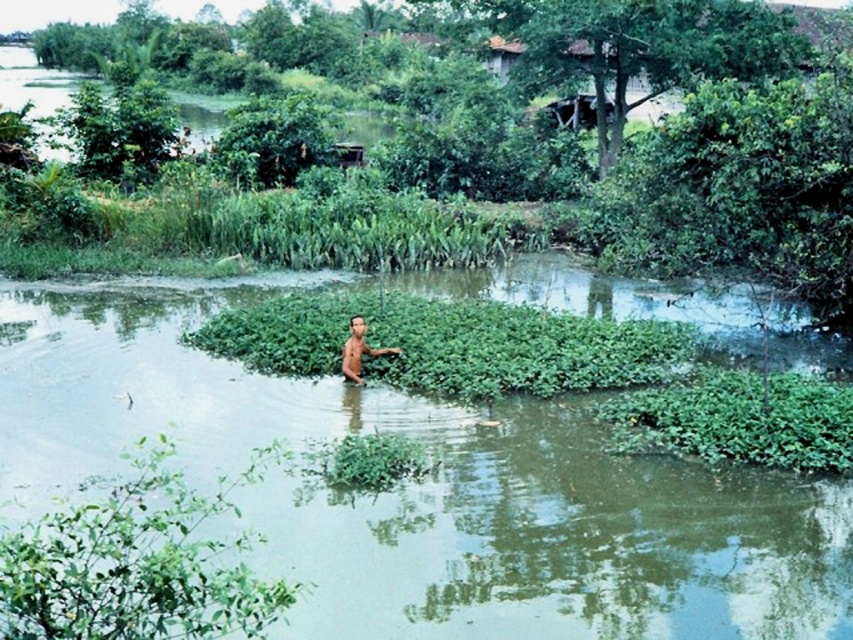
You are a hiker who needs to cross the shallow water to reach the open area beyond the vegetation. The green leafy vegetation at center and the green leafy plant at lower left are in your path. Which one should you avoid stepping on to stay on the higher ground?

The green leafy vegetation at center is above the green leafy plant at lower left, so you should avoid stepping on the green leafy vegetation at center to stay on the higher ground.

You are a photographer trying to capture a clear shot of the brown skin man at center. However, there is a green leafy plant at lower left blocking your view. Can you move the plant to get a better angle? Explain your reasoning based on their positions.

The green leafy plant at lower left is in front of the brown skin man at center, so moving the plant would allow you to see the man clearly. However, since plants are part of the environment, physically moving it might not be feasible without disturbing the scene. Alternatively, adjusting your position to angle around the plant could provide an unobstructed view.

You are standing at the point labeled point (x=148, y=620) and want to reach the point labeled point (x=373, y=355). Given that the water depth increases as you move away from the shore, will you encounter deeper water as you move towards your destination?

Yes, since point (x=148, y=620) is in front of point (x=373, y=355), moving towards it means moving away from the shore where the water depth increases.